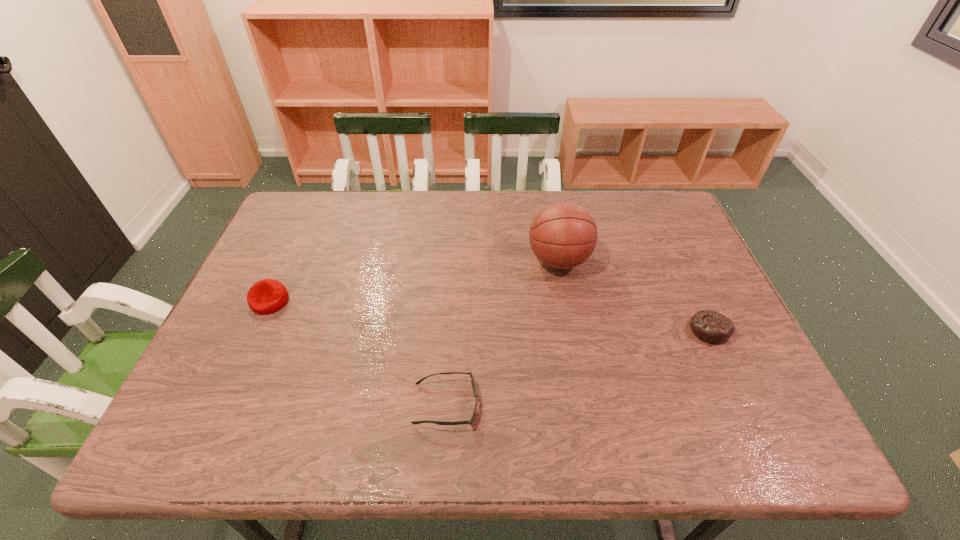
Locate an element on the screen. vacant region between the rightmost object and the third shortest object is located at coordinates click(490, 315).

Select which object appears as the second closest to the right beanbag. Please provide its 2D coordinates. Your answer should be formatted as a tuple, i.e. [(x, y)], where the tuple contains the x and y coordinates of a point satisfying the conditions above.

[(473, 383)]

Choose which object is the nearest neighbor to the second object from right to left. Please provide its 2D coordinates. Your answer should be formatted as a tuple, i.e. [(x, y)], where the tuple contains the x and y coordinates of a point satisfying the conditions above.

[(711, 327)]

Image resolution: width=960 pixels, height=540 pixels. Find the location of `vacant space that satisfies the following two spatial constraints: 1. on the seat area of the third tallest object; 2. on the right side of the left beanbag`. vacant space that satisfies the following two spatial constraints: 1. on the seat area of the third tallest object; 2. on the right side of the left beanbag is located at coordinates (257, 330).

The width and height of the screenshot is (960, 540). In order to click on vacant space that satisfies the following two spatial constraints: 1. on the seat area of the leftmost object; 2. on the left side of the rightmost object in this screenshot , I will do `click(257, 330)`.

In order to click on blank area in the image that satisfies the following two spatial constraints: 1. on the front side of the second shortest object; 2. on the front-facing side of the sunglasses in this screenshot , I will do `click(744, 404)`.

This screenshot has width=960, height=540. What are the coordinates of `free point that satisfies the following two spatial constraints: 1. on the seat area of the right beanbag; 2. on the left side of the taller beanbag` in the screenshot? It's located at (257, 330).

Where is `vacant space that satisfies the following two spatial constraints: 1. on the front side of the farthest object; 2. on the front-facing side of the nearest object`? Image resolution: width=960 pixels, height=540 pixels. vacant space that satisfies the following two spatial constraints: 1. on the front side of the farthest object; 2. on the front-facing side of the nearest object is located at coordinates (586, 404).

Locate an element on the screen. The image size is (960, 540). free space that satisfies the following two spatial constraints: 1. on the seat area of the taller beanbag; 2. on the right side of the rightmost object is located at coordinates (257, 330).